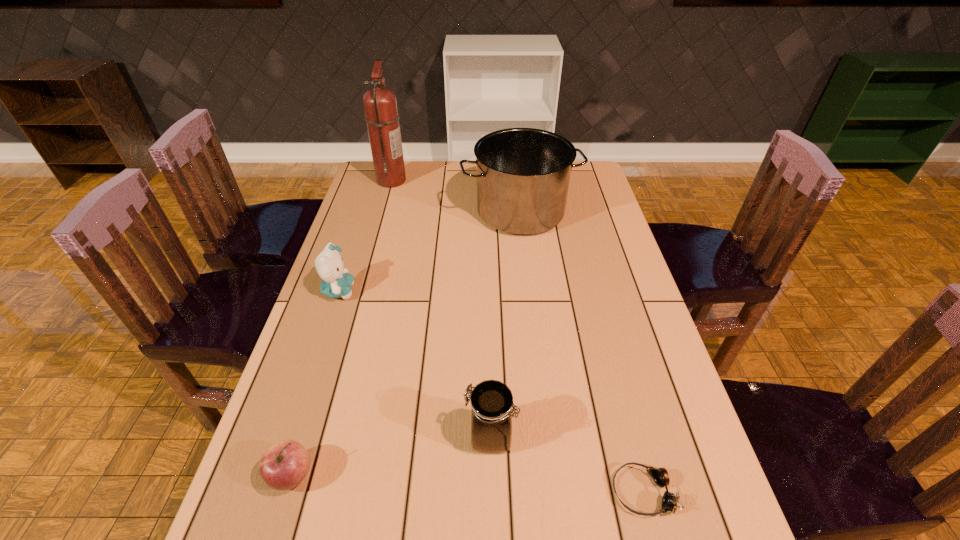
Image resolution: width=960 pixels, height=540 pixels. Identify the location of free space located 0.060m on the lid of the jar. (437, 437).

The height and width of the screenshot is (540, 960). In order to click on vacant space situated 0.110m on the face of the kitten in this screenshot , I will do `click(394, 291)`.

What are the coordinates of `blank space located 0.070m on the back of the apple` in the screenshot? It's located at (308, 423).

Find the location of `free space located 0.400m through the lenses of the shortest object`. free space located 0.400m through the lenses of the shortest object is located at coordinates (406, 492).

Find the location of a particular element. The width and height of the screenshot is (960, 540). free space located through the lenses of the shortest object is located at coordinates (556, 492).

Locate an element on the screen. vacant area situated through the lenses of the shortest object is located at coordinates (561, 492).

Where is `fire extinguisher present at the far edge`? fire extinguisher present at the far edge is located at coordinates (380, 106).

You are a GUI agent. You are given a task and a screenshot of the screen. Output one action in this format:
    pyautogui.click(x=<x>, y=<y>)
    Task: Click on the saucepan located at the far edge
    This screenshot has height=540, width=960.
    Given the screenshot: What is the action you would take?
    pyautogui.click(x=523, y=174)

Locate an element on the screen. This screenshot has height=540, width=960. fire extinguisher that is at the left edge is located at coordinates (380, 106).

Where is `kitten that is positioned at the left edge`? Image resolution: width=960 pixels, height=540 pixels. kitten that is positioned at the left edge is located at coordinates (337, 283).